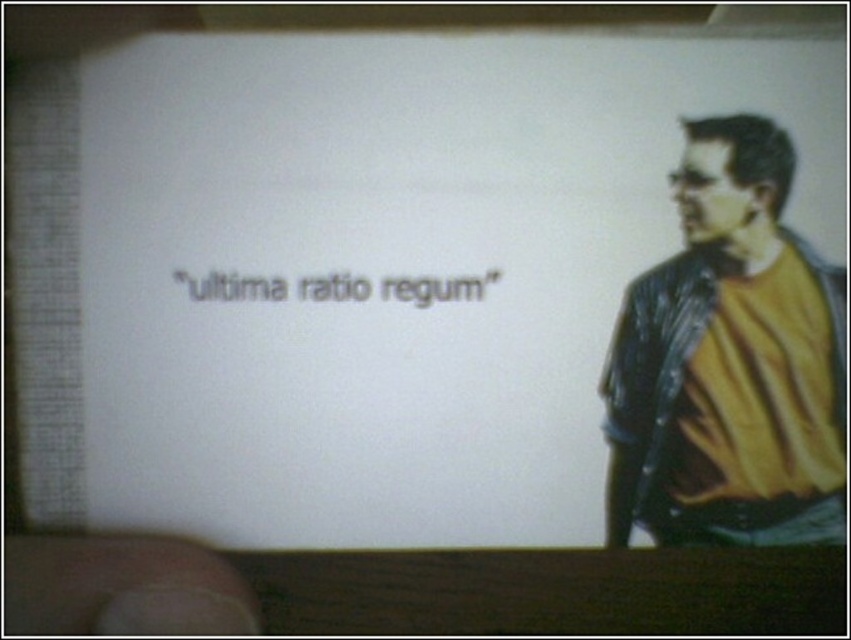
You are a photographer setting up for a portrait. You notice the matte black leather jacket at right and the smooth skin finger at lower left in the frame. Which object should you adjust your camera focus on if you want to ensure the subject wearing the jacket is in focus?

You should focus on the matte black leather jacket at right because it is closer to the subject wearing it compared to the smooth skin finger at lower left, ensuring the jacket remains sharp in the photo.

You are standing in front of the projection screen and notice a specific point on the screen. Based on the coordinates given, can you identify what object is located at point (729,362)?

The point at coordinates (729,362) corresponds to the matte black leather jacket at right.

You are standing in front of the projection screen and notice two points marked on it. The first point is at coordinates point (774, 200) and the second is at point (353, 280). Which point is closer to you as you face the screen?

Point (353, 280) is closer to you because it is in front of point (774, 200).